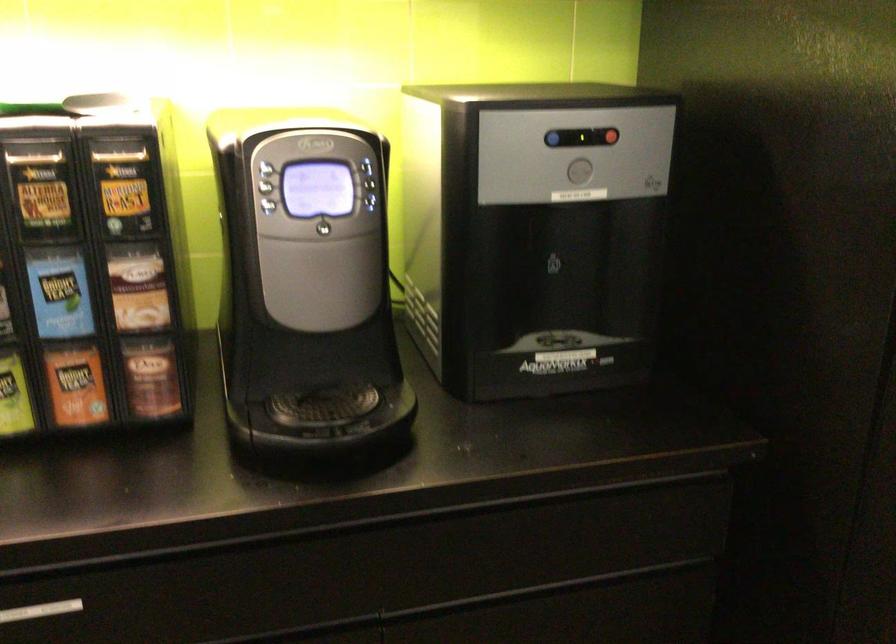
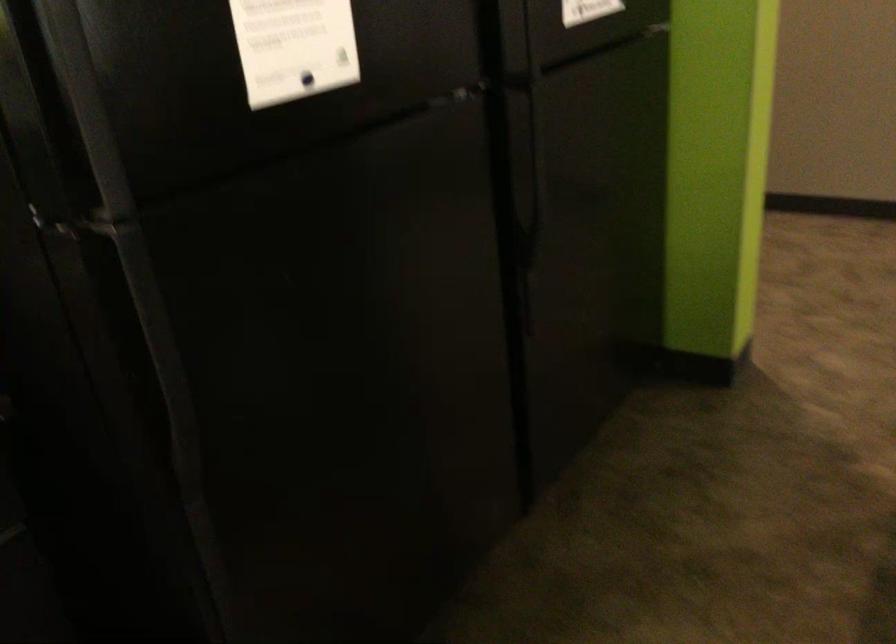
Question: The camera is either moving clockwise (left) or counter-clockwise (right) around the object. The first image is from the beginning of the video and the second image is from the end. Is the camera moving left or right when shooting the video?

Choices:
 (A) Left
 (B) Right

Answer: (A)